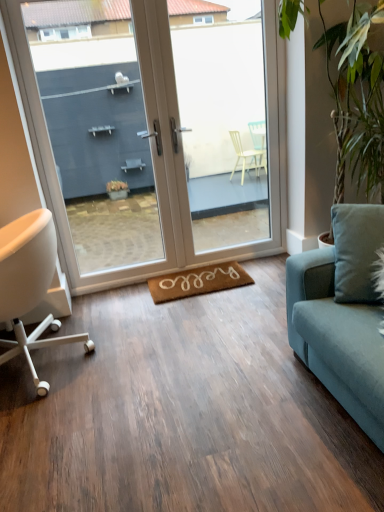
This screenshot has width=384, height=512. I want to click on unoccupied area in front of white matte chair at left, so click(x=61, y=424).